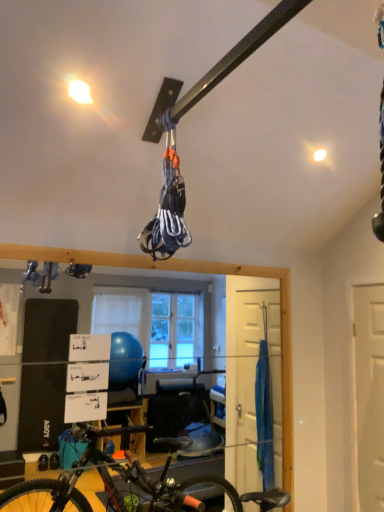
Question: Considering the positions of white matte door at right and black matte bicycle at lower left in the image, is white matte door at right wider or thinner than black matte bicycle at lower left?

Choices:
 (A) wide
 (B) thin

Answer: (B)

Question: Looking at the image, does white matte door at right seem bigger or smaller compared to black matte bicycle at lower left?

Choices:
 (A) small
 (B) big

Answer: (A)

Question: From the image's perspective, relative to black matte bicycle at lower left, is white matte door at right above or below?

Choices:
 (A) below
 (B) above

Answer: (B)

Question: Would you say black matte bicycle at lower left is to the left or to the right of white matte door at right in the picture?

Choices:
 (A) right
 (B) left

Answer: (B)

Question: Would you say black matte bicycle at lower left is inside or outside white matte door at right?

Choices:
 (A) outside
 (B) inside

Answer: (A)

Question: Considering the positions of point (168, 489) and point (374, 412), is point (168, 489) closer or farther from the camera than point (374, 412)?

Choices:
 (A) closer
 (B) farther

Answer: (A)

Question: Based on their sizes in the image, would you say black matte bicycle at lower left is bigger or smaller than white matte door at right?

Choices:
 (A) small
 (B) big

Answer: (B)